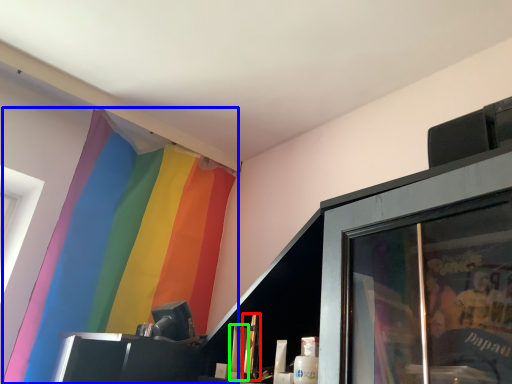
Question: Which object is positioned farthest from toiletry (highlighted by a red box)? Select from curtain (highlighted by a blue box) and toiletry (highlighted by a green box).

Choices:
 (A) curtain
 (B) toiletry

Answer: (A)